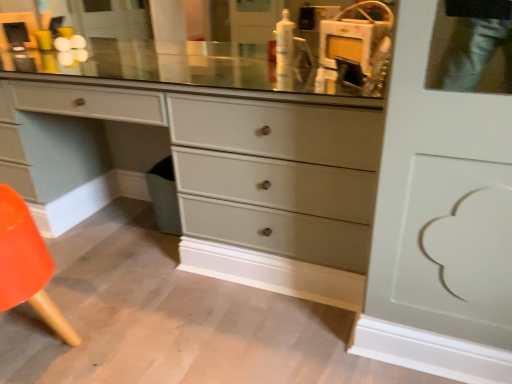
Locate an element on the screen. unoccupied region to the right of orange plastic chair at lower left is located at coordinates (144, 333).